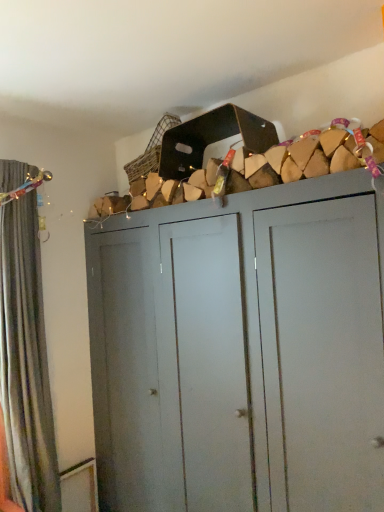
The width and height of the screenshot is (384, 512). What are the coordinates of `matte gray cupboard at center` in the screenshot? It's located at (241, 351).

This screenshot has height=512, width=384. What do you see at coordinates (241, 351) in the screenshot?
I see `matte gray cupboard at center` at bounding box center [241, 351].

Measure the distance between point [17,397] and camera.

A distance of 6.90 feet exists between point [17,397] and camera.

What do you see at coordinates (26, 361) in the screenshot?
I see `velvet dark grey curtain at left` at bounding box center [26, 361].

You are a GUI agent. You are given a task and a screenshot of the screen. Output one action in this format:
    pyautogui.click(x=<x>, y=<y>)
    Task: Click on the velvet dark grey curtain at left
    Image resolution: width=384 pixels, height=512 pixels.
    Given the screenshot: What is the action you would take?
    pyautogui.click(x=26, y=361)

I want to click on matte gray cupboard at center, so click(x=241, y=351).

Is matte gray cupboard at center at the left side of velvet dark grey curtain at left?

Incorrect, matte gray cupboard at center is not on the left side of velvet dark grey curtain at left.

Looking at this image, considering their positions, is matte gray cupboard at center located in front of or behind velvet dark grey curtain at left?

In the image, matte gray cupboard at center appears in front of velvet dark grey curtain at left.

Does point (120, 242) come in front of point (57, 487)?

That is False.

From the image's perspective, relative to velvet dark grey curtain at left, is matte gray cupboard at center above or below?

matte gray cupboard at center is situated lower than velvet dark grey curtain at left in the image.

From a real-world perspective, does matte gray cupboard at center sit lower than velvet dark grey curtain at left?

Correct, in the physical world, matte gray cupboard at center is lower than velvet dark grey curtain at left.

Does matte gray cupboard at center have a lesser width compared to velvet dark grey curtain at left?

No, matte gray cupboard at center is not thinner than velvet dark grey curtain at left.

Which of these two, matte gray cupboard at center or velvet dark grey curtain at left, stands shorter?

With less height is velvet dark grey curtain at left.

Which of these two, matte gray cupboard at center or velvet dark grey curtain at left, is smaller?

With smaller size is velvet dark grey curtain at left.

Is matte gray cupboard at center spatially inside velvet dark grey curtain at left, or outside of it?

matte gray cupboard at center is outside velvet dark grey curtain at left.

Does matte gray cupboard at center touch velvet dark grey curtain at left?

No, matte gray cupboard at center is not in contact with velvet dark grey curtain at left.

Is matte gray cupboard at center aimed at velvet dark grey curtain at left?

Yes, matte gray cupboard at center is aimed at velvet dark grey curtain at left.

How many degrees apart are the facing directions of matte gray cupboard at center and velvet dark grey curtain at left?

matte gray cupboard at center and velvet dark grey curtain at left are facing 89.5 degrees away from each other.

This screenshot has height=512, width=384. In the image, there is a velvet dark grey curtain at left. Find the location of `cupboard below it (from the image's perspective)`. cupboard below it (from the image's perspective) is located at coordinates (241, 351).

Based on their positions, is velvet dark grey curtain at left located to the left or right of matte gray cupboard at center?

From the image, it's evident that velvet dark grey curtain at left is to the left of matte gray cupboard at center.

Is velvet dark grey curtain at left in front of matte gray cupboard at center?

No, velvet dark grey curtain at left is further to the viewer.

Considering the positions of points (12, 444) and (307, 490), is point (12, 444) farther from camera compared to point (307, 490)?

Yes, it is.

From the image's perspective, which one is positioned lower, velvet dark grey curtain at left or matte gray cupboard at center?

matte gray cupboard at center is shown below in the image.

From a real-world perspective, is velvet dark grey curtain at left positioned under matte gray cupboard at center based on gravity?

No, from a real-world perspective, velvet dark grey curtain at left is not below matte gray cupboard at center.

Which of these two, velvet dark grey curtain at left or matte gray cupboard at center, is wider?

matte gray cupboard at center.

Who is taller, velvet dark grey curtain at left or matte gray cupboard at center?

matte gray cupboard at center is taller.

Which of these two, velvet dark grey curtain at left or matte gray cupboard at center, is bigger?

matte gray cupboard at center is bigger.

Do you think velvet dark grey curtain at left is within matte gray cupboard at center, or outside of it?

velvet dark grey curtain at left is spatially situated outside matte gray cupboard at center.

Are velvet dark grey curtain at left and matte gray cupboard at center located far from each other?

That's not correct — velvet dark grey curtain at left is a little close to matte gray cupboard at center.

Is matte gray cupboard at center at the back of velvet dark grey curtain at left?

No, velvet dark grey curtain at left's orientation is not away from matte gray cupboard at center.

How much distance is there between velvet dark grey curtain at left and matte gray cupboard at center?

They are 34.87 inches apart.

Image resolution: width=384 pixels, height=512 pixels. I want to click on cupboard on the right of the velvet dark grey curtain at left, so click(241, 351).

Locate an element on the screen. Image resolution: width=384 pixels, height=512 pixels. curtain that is above the matte gray cupboard at center (from a real-world perspective) is located at coordinates (26, 361).

The height and width of the screenshot is (512, 384). In order to click on curtain above the matte gray cupboard at center (from the image's perspective) in this screenshot , I will do `click(26, 361)`.